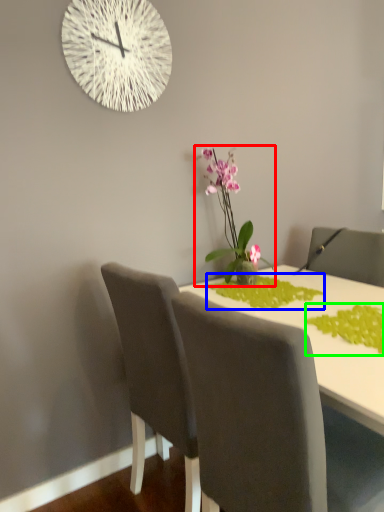
Question: Based on their relative distances, which object is farther from houseplant (highlighted by a red box)? Choose from plant (highlighted by a blue box) and plant (highlighted by a green box).

Choices:
 (A) plant
 (B) plant

Answer: (B)